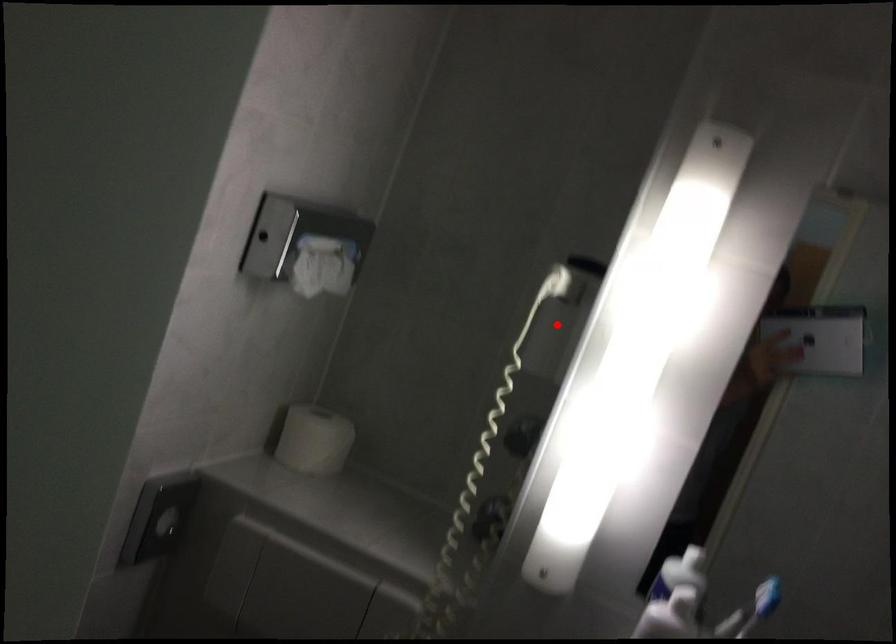
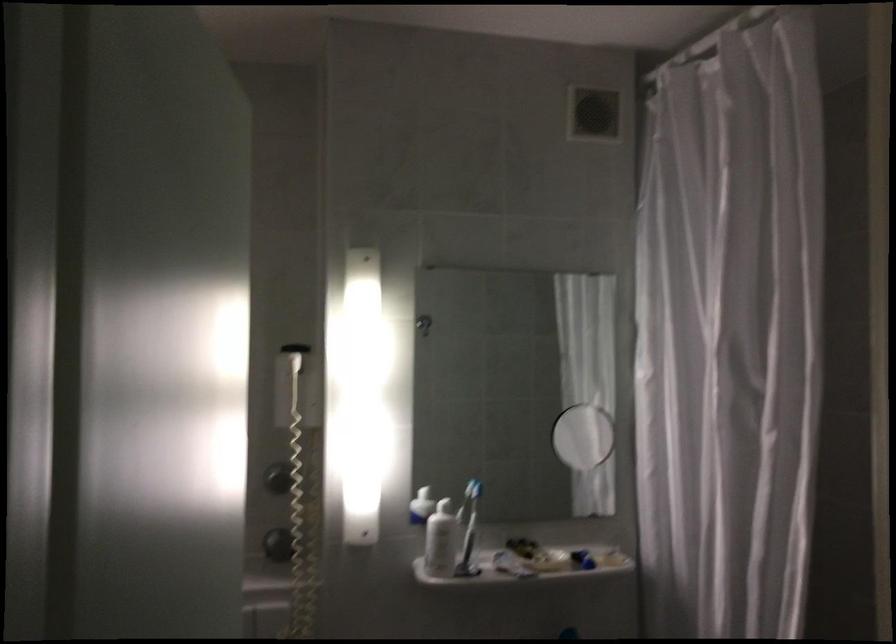
Find the pixel in the second image that matches the highlighted location in the first image.

(293, 384)